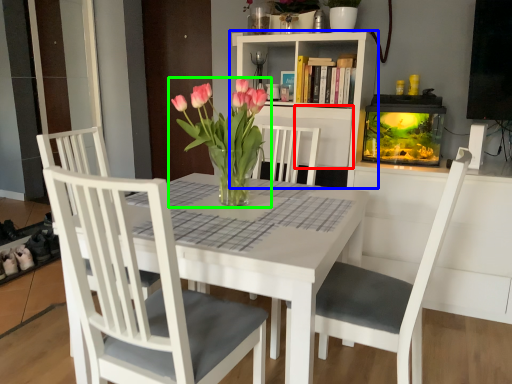
Question: Which is nearer to the shelf (highlighted by a red box)? bookcase (highlighted by a blue box) or houseplant (highlighted by a green box).

Choices:
 (A) bookcase
 (B) houseplant

Answer: (A)